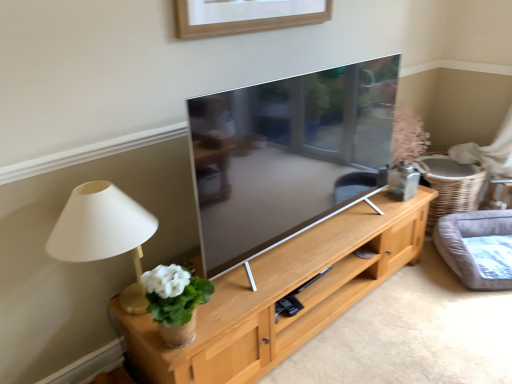
Question: Is white ceramic vase at left closer to the viewer compared to matte beige lamp at left?

Choices:
 (A) no
 (B) yes

Answer: (A)

Question: Can you confirm if white ceramic vase at left is thinner than matte beige lamp at left?

Choices:
 (A) no
 (B) yes

Answer: (B)

Question: From a real-world perspective, is white ceramic vase at left over matte beige lamp at left?

Choices:
 (A) no
 (B) yes

Answer: (A)

Question: Is white ceramic vase at left oriented away from matte beige lamp at left?

Choices:
 (A) no
 (B) yes

Answer: (B)

Question: Is white ceramic vase at left next to matte beige lamp at left and touching it?

Choices:
 (A) no
 (B) yes

Answer: (A)

Question: Is white ceramic vase at left facing towards matte beige lamp at left?

Choices:
 (A) no
 (B) yes

Answer: (A)

Question: From the image's perspective, does white ceramic vase at left appear lower than light wood cabinet at center?

Choices:
 (A) yes
 (B) no

Answer: (B)

Question: Does white ceramic vase at left lie behind light wood cabinet at center?

Choices:
 (A) no
 (B) yes

Answer: (B)

Question: Does white ceramic vase at left have a greater width compared to light wood cabinet at center?

Choices:
 (A) no
 (B) yes

Answer: (A)

Question: Considering the relative positions of white ceramic vase at left and light wood cabinet at center in the image provided, is white ceramic vase at left to the right of light wood cabinet at center from the viewer's perspective?

Choices:
 (A) yes
 (B) no

Answer: (B)

Question: From the image's perspective, would you say white ceramic vase at left is positioned over light wood cabinet at center?

Choices:
 (A) no
 (B) yes

Answer: (B)

Question: Is white ceramic vase at left positioned far away from light wood cabinet at center?

Choices:
 (A) yes
 (B) no

Answer: (B)

Question: Is gray fabric cat bed at right to the right of matte beige lamp at left from the viewer's perspective?

Choices:
 (A) no
 (B) yes

Answer: (B)